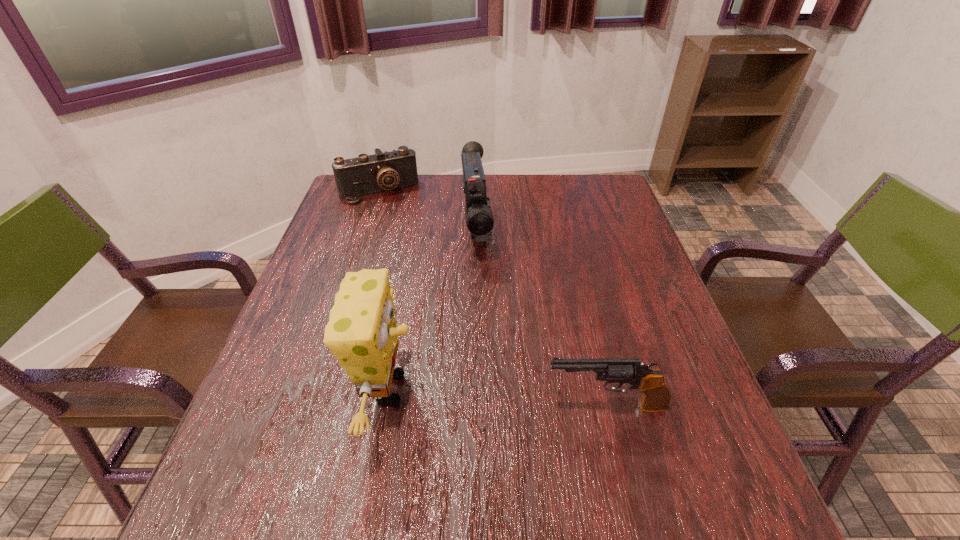
This screenshot has width=960, height=540. I want to click on vacant region that satisfies the following two spatial constraints: 1. on the front side of the sponge; 2. on the face of the camera, so click(314, 389).

Locate an element on the screen. vacant space that satisfies the following two spatial constraints: 1. on the front side of the camera; 2. on the face of the sponge is located at coordinates (314, 389).

Identify the location of vacant area that satisfies the following two spatial constraints: 1. on the front side of the shortest object; 2. along the barrel of the rightmost object. (309, 406).